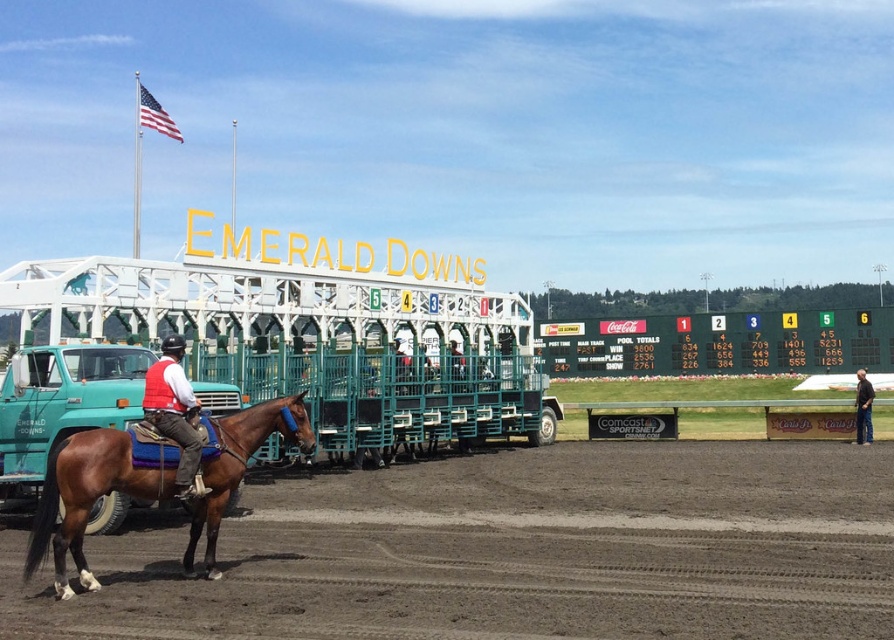
You are a photographer at Emerald Downs preparing to take a photo of the starting gate. You notice the brown glossy horse at center and the matte red vest at center in your shot. Which object is wider in the image?

The brown glossy horse at center is wider than the matte red vest at center.

You are a photographer at Emerald Downs and want to capture a photo of the brown glossy horse at center and the matte red vest at center. Which object should you focus on first if you want to ensure both are in focus without adjusting the camera settings?

The brown glossy horse at center is shorter than the matte red vest at center, so you should focus on the matte red vest at center first since it is farther away. This way, the depth of field will include both objects more effectively.